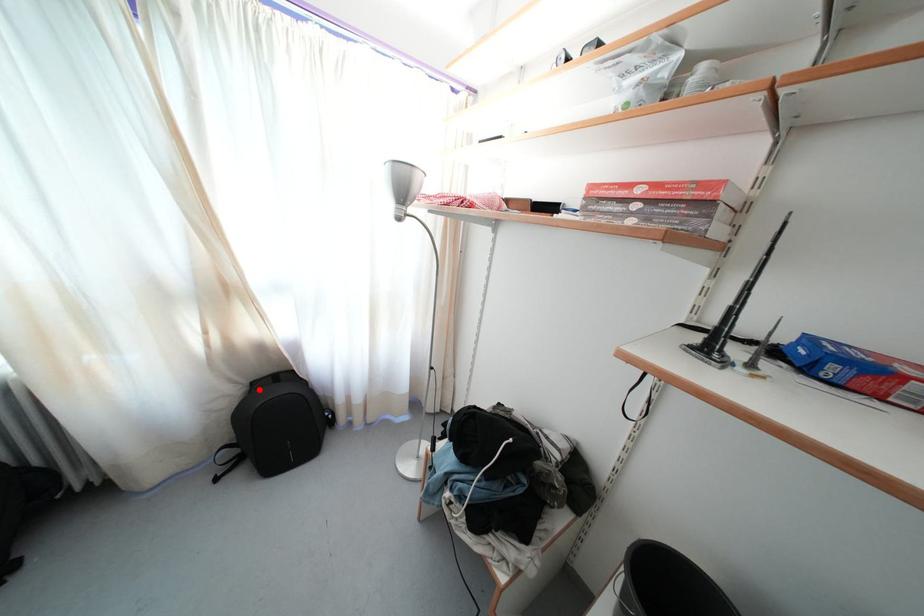
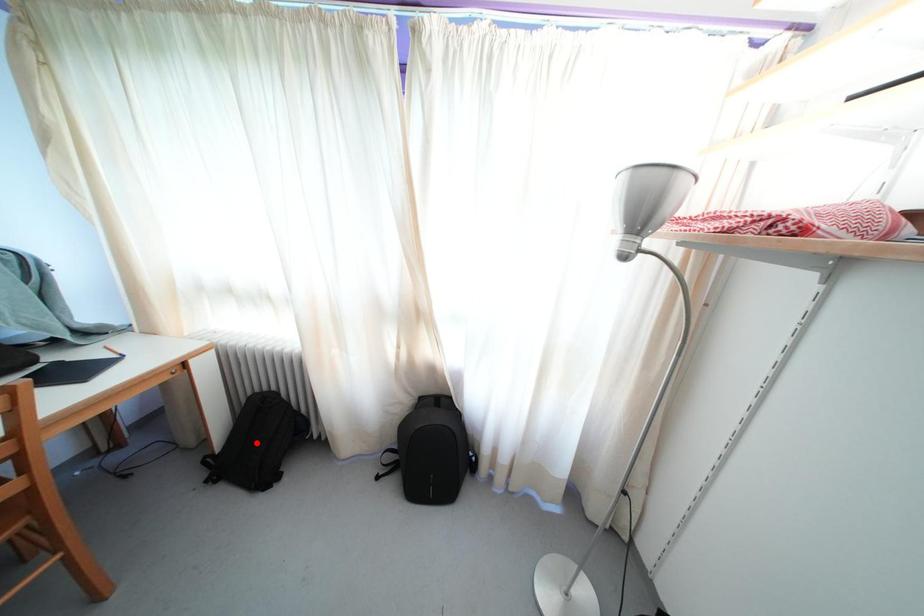
I am providing you with two images of the same scene from different viewpoints. A red point is marked on the first image and another point is marked on the second image. Is the marked point in image1 the same physical position as the marked point in image2?

No